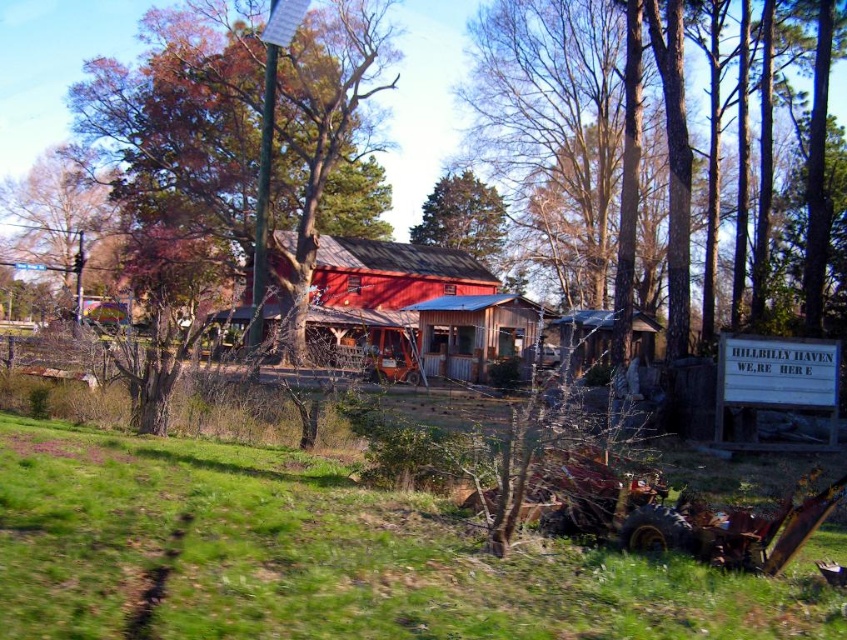
Looking at this image, you are standing in the rural scene and want to walk from the point at coordinates point (512,74) to the point at coordinates point (645,339). Since you can only move forward, will you have to walk towards or away from the viewer to reach your destination?

Since point (512,74) is further to the viewer than point (645,339), you will have to walk away from the viewer to reach point (645,339).

You are standing at the center of the image and want to find the smooth bark tree at center. According to the coordinates provided, in which direction should you look to locate it?

The smooth bark tree at center is located at coordinates point (551, 122), so you should look to the lower left direction from the center to find it.